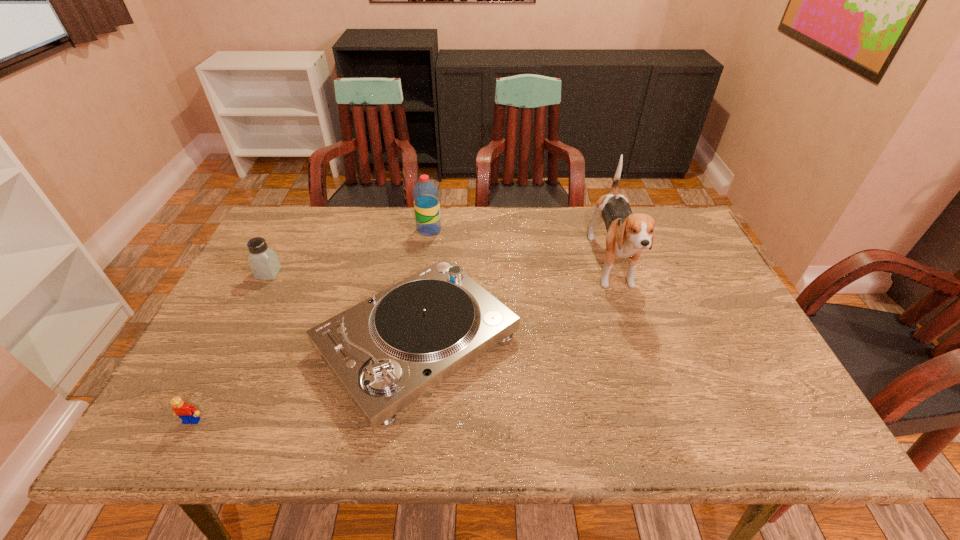
The width and height of the screenshot is (960, 540). In order to click on puppy that is positioned at the far edge in this screenshot , I will do `click(627, 234)`.

Where is `water bottle that is at the far edge`? This screenshot has width=960, height=540. water bottle that is at the far edge is located at coordinates (425, 193).

Find the location of `record player that is at the near edge`. record player that is at the near edge is located at coordinates (387, 351).

Locate an element on the screen. Image resolution: width=960 pixels, height=540 pixels. Lego at the near edge is located at coordinates (188, 414).

The width and height of the screenshot is (960, 540). In order to click on saltshaker located at the left edge in this screenshot , I will do `click(263, 261)`.

This screenshot has height=540, width=960. Identify the location of Lego present at the left edge. (188, 414).

Locate an element on the screen. object positioned at the near left corner is located at coordinates pos(188,414).

In the image, there is a desktop. Where is `vacant space at the far edge`? vacant space at the far edge is located at coordinates (577, 227).

Where is `vacant space at the near edge of the desktop`? The image size is (960, 540). vacant space at the near edge of the desktop is located at coordinates (228, 443).

Find the location of a particular element. The height and width of the screenshot is (540, 960). vacant position at the left edge of the desktop is located at coordinates (263, 294).